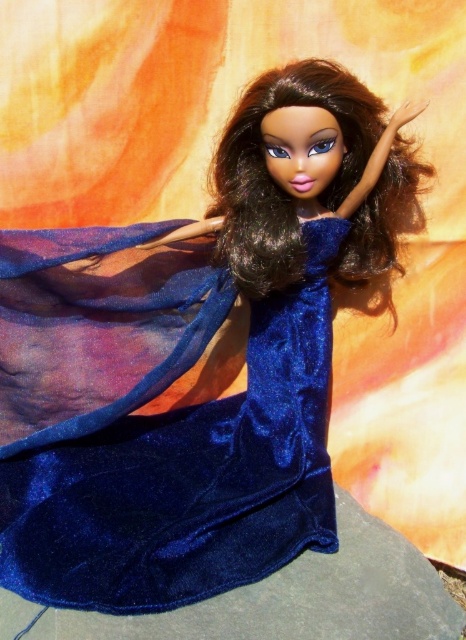
Question: Which point appears closest to the camera in this image?

Choices:
 (A) (233, 144)
 (B) (164, 221)
 (C) (212, 637)

Answer: (C)

Question: Among these points, which one is farthest from the camera?

Choices:
 (A) (338, 588)
 (B) (245, 145)
 (C) (38, 394)

Answer: (C)

Question: Is the position of shiny blue fabric dress at center more distant than that of shiny dark brown hair at center?

Choices:
 (A) no
 (B) yes

Answer: (A)

Question: Is shiny blue fabric dress at center wider than shiny dark brown hair at center?

Choices:
 (A) no
 (B) yes

Answer: (B)

Question: Which point is farther from the camera taking this photo?

Choices:
 (A) (224, 604)
 (B) (66, 554)
 (C) (223, 205)

Answer: (C)

Question: Can you confirm if shiny blue fabric dress at center is wider than velvet blue fabric at center?

Choices:
 (A) no
 (B) yes

Answer: (A)